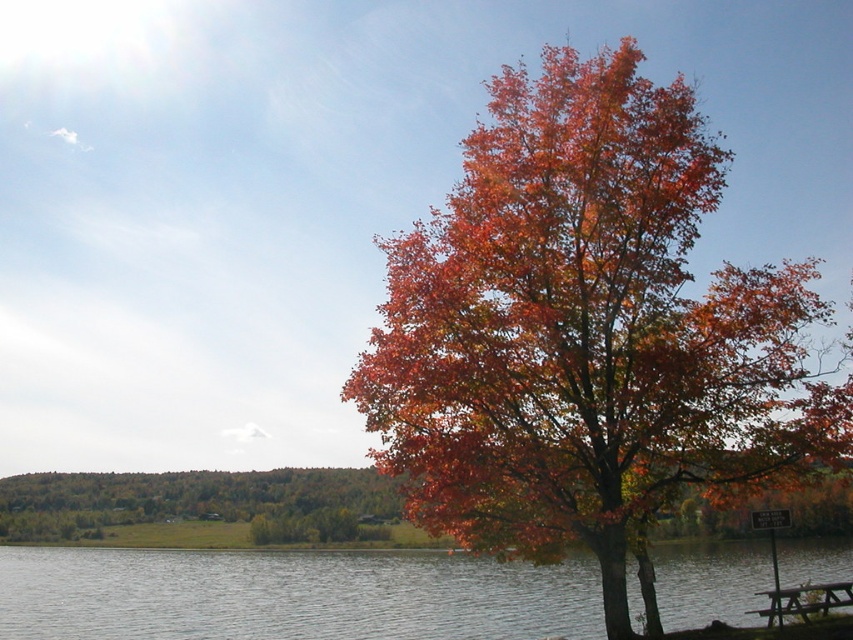
Question: Based on their relative distances, which object is nearer to the clear water at lower center?

Choices:
 (A) orange leafy tree at center
 (B) shiny orange leaves at center

Answer: (A)

Question: Which object appears farthest from the camera in this image?

Choices:
 (A) orange leafy tree at center
 (B) wooden picnic table at lower right
 (C) clear water at lower center

Answer: (A)

Question: Can you confirm if clear water at lower center is positioned to the right of orange leafy tree at center?

Choices:
 (A) no
 (B) yes

Answer: (B)

Question: Which point appears farthest from the camera in this image?

Choices:
 (A) (155, 513)
 (B) (822, 582)

Answer: (A)

Question: Does shiny orange leaves at center appear on the left side of orange leafy tree at center?

Choices:
 (A) yes
 (B) no

Answer: (B)

Question: Is orange leafy tree at center in front of wooden picnic table at lower right?

Choices:
 (A) yes
 (B) no

Answer: (B)